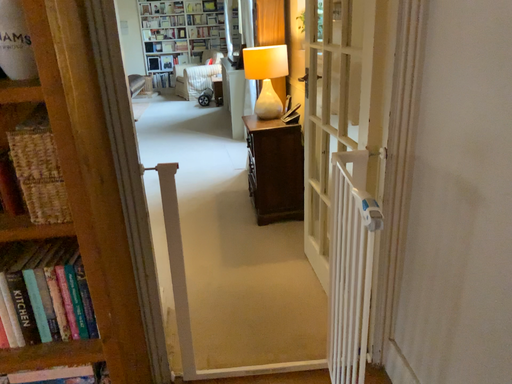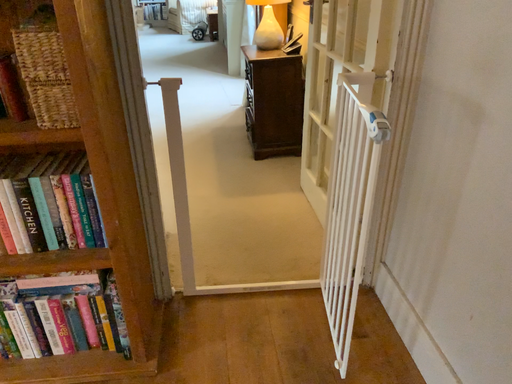
Question: Which way did the camera rotate in the video?

Choices:
 (A) rotated downward
 (B) rotated upward

Answer: (A)